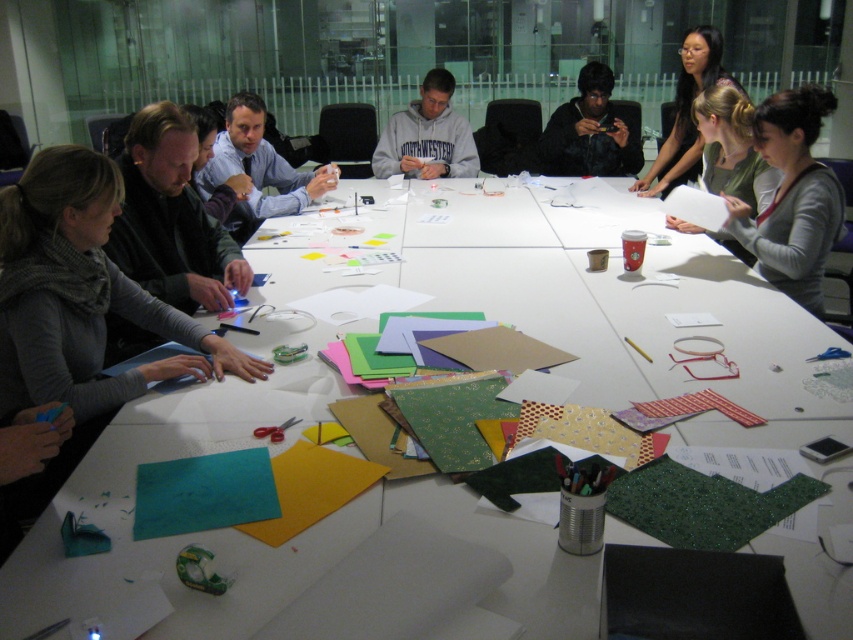
Is point (601, 140) more distant than point (444, 150)?

Yes, it is behind point (444, 150).

Is dark brown textured sweater at upper center bigger than gray fleece hoodie at center?

Yes, dark brown textured sweater at upper center is bigger than gray fleece hoodie at center.

This screenshot has height=640, width=853. What are the coordinates of `dark brown textured sweater at upper center` in the screenshot? It's located at (589, 131).

What do you see at coordinates (171, 218) in the screenshot? I see `matte black laptop at left` at bounding box center [171, 218].

Which is behind, point (190, 147) or point (712, 52)?

The point (712, 52) is more distant.

Find the location of a particular element. matte black laptop at left is located at coordinates (171, 218).

Is white paper at center smaller than matte black laptop at left?

Actually, white paper at center might be larger than matte black laptop at left.

Can you confirm if white paper at center is shorter than matte black laptop at left?

No, white paper at center is not shorter than matte black laptop at left.

The image size is (853, 640). I want to click on white paper at center, so click(606, 312).

Where is `white paper at center`? The image size is (853, 640). white paper at center is located at coordinates (606, 312).